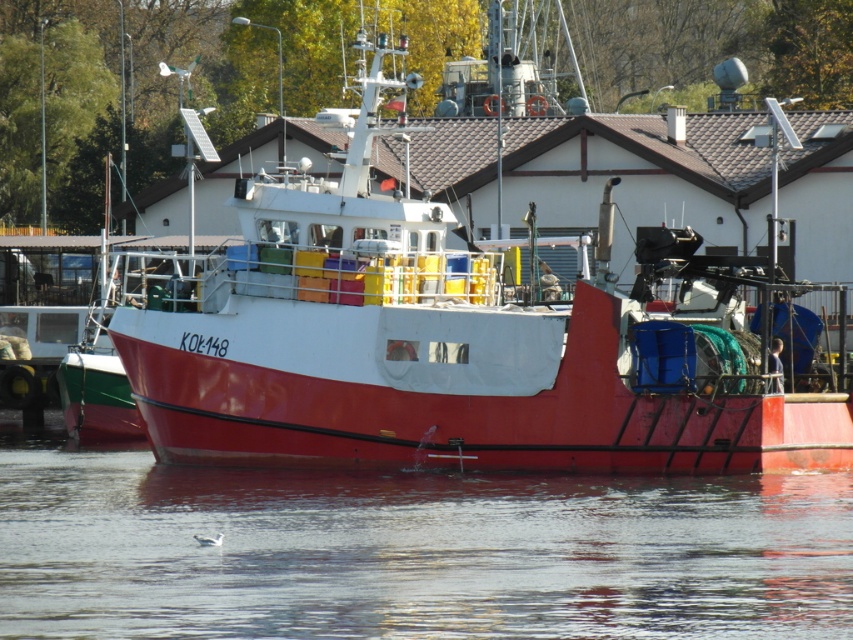
You are standing on the dock and see the red matte boat at center and the transparent water at lower center. Which object is closer to you from your current position?

The red matte boat at center is closer to you than the transparent water at lower center because the transparent water at lower center is positioned behind the red matte boat at center.

You are standing on the dock and see the red matte boat at center and the transparent water at lower center. Which object is positioned to the right of the other?

The red matte boat at center is to the right of transparent water at lower center.

You are standing on the dock and want to board the red matte boat at center. The transparent water at lower center is in your path. Since the boat is taller than the water, will you need to step up or down to get onto the boat from the dock?

The red matte boat at center is taller than transparent water at lower center, so you will need to step up to board the boat from the dock.